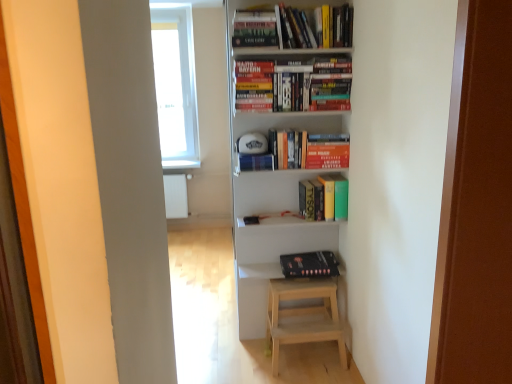
The width and height of the screenshot is (512, 384). I want to click on vacant area on top of hardcover books at upper center, the 4th book from the bottom (from a real-world perspective), so click(x=287, y=3).